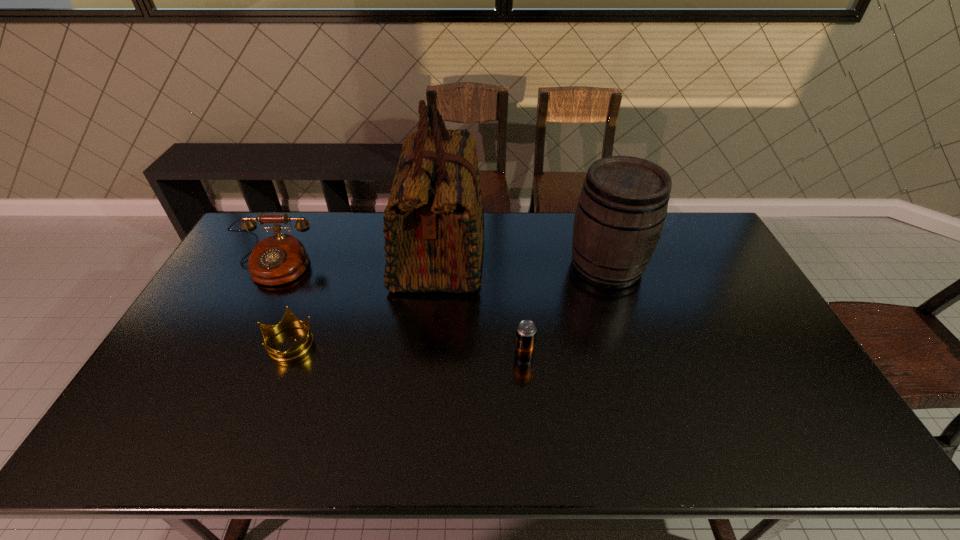
This screenshot has width=960, height=540. Identify the location of vacant area at the left edge. (182, 404).

This screenshot has width=960, height=540. Identify the location of vacant space at the right edge of the desktop. (740, 294).

Where is `free space at the far left corner of the desktop`? The height and width of the screenshot is (540, 960). free space at the far left corner of the desktop is located at coordinates (287, 229).

This screenshot has width=960, height=540. Find the location of `free point between the shopping bag and the beer can`. free point between the shopping bag and the beer can is located at coordinates (482, 305).

The width and height of the screenshot is (960, 540). I want to click on free spot between the tallest object and the second tallest object, so click(x=523, y=259).

Image resolution: width=960 pixels, height=540 pixels. In order to click on blank region between the fourth tallest object and the telephone in this screenshot , I will do `click(398, 312)`.

In order to click on free space between the shopping bag and the third tallest object in this screenshot , I will do `click(357, 260)`.

This screenshot has width=960, height=540. What are the coordinates of `free area in between the beer can and the tallest object` in the screenshot? It's located at (482, 305).

The width and height of the screenshot is (960, 540). I want to click on vacant region between the shortest object and the rightmost object, so click(448, 304).

Where is `vacant region between the telephone and the fourth object from left to right`? The width and height of the screenshot is (960, 540). vacant region between the telephone and the fourth object from left to right is located at coordinates (398, 312).